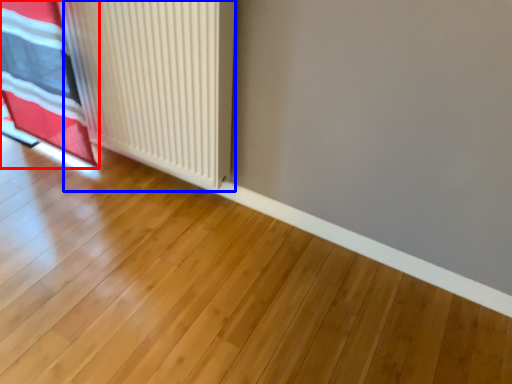
Question: Which of the following is the farthest to the observer, curtain (highlighted by a red box) or radiator (highlighted by a blue box)?

Choices:
 (A) curtain
 (B) radiator

Answer: (A)